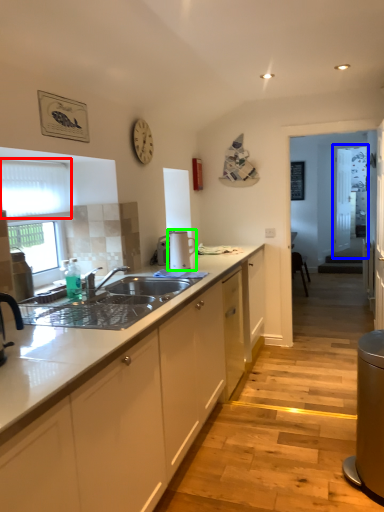
Question: Based on their relative distances, which object is nearer to window screen (highlighted by a red box)? Choose from glass door (highlighted by a blue box) and appliance (highlighted by a green box).

Choices:
 (A) glass door
 (B) appliance

Answer: (B)